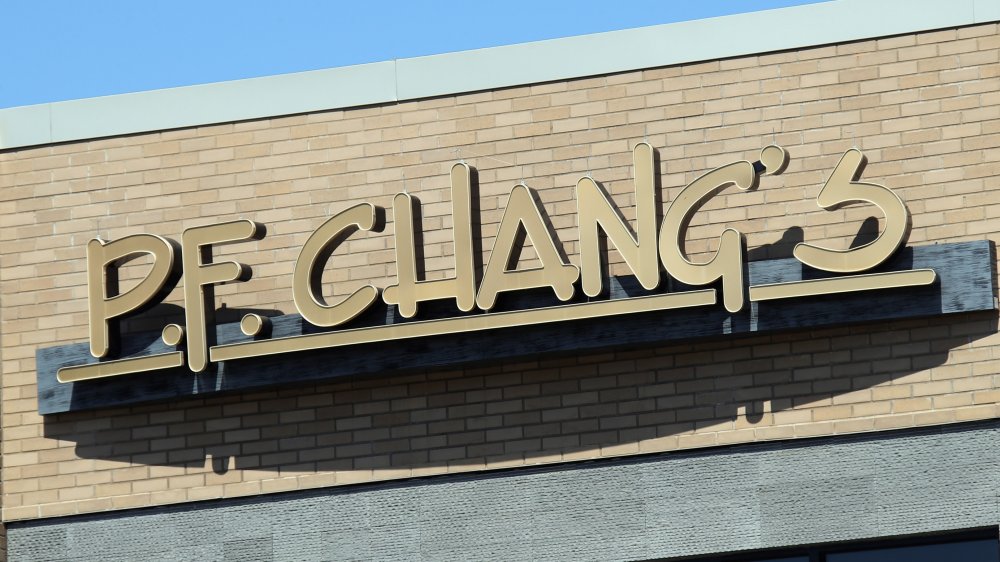
This screenshot has width=1000, height=562. Identify the location of brick wall. (768, 78).